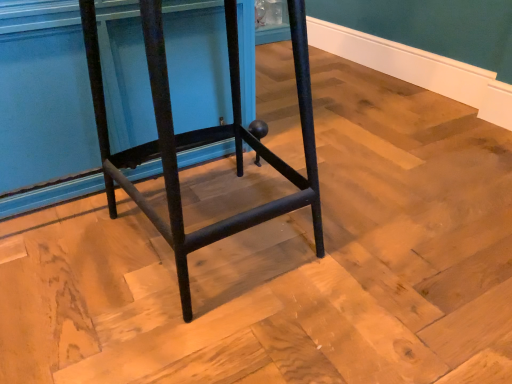
Find the location of `blank space to the left of black metal stool at center`. blank space to the left of black metal stool at center is located at coordinates (65, 247).